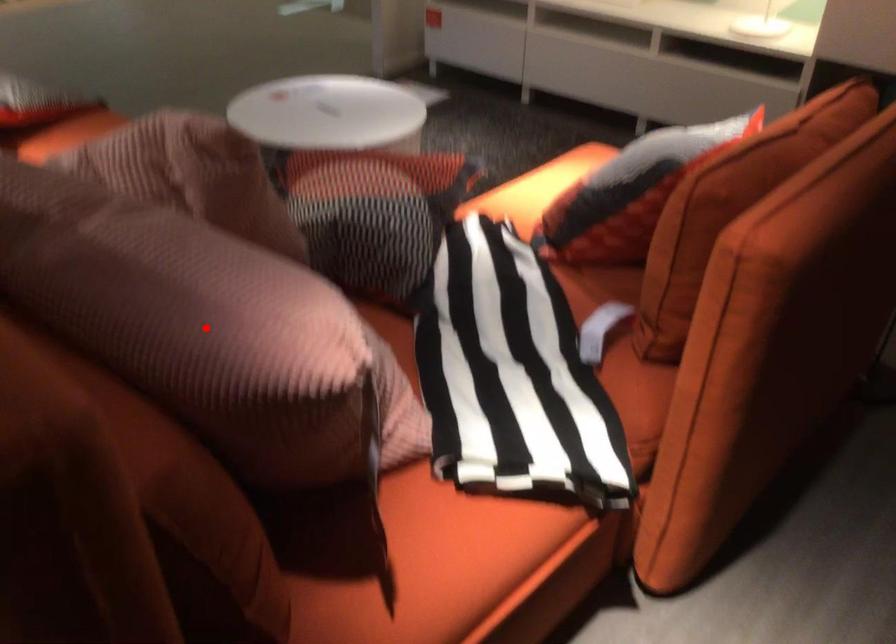
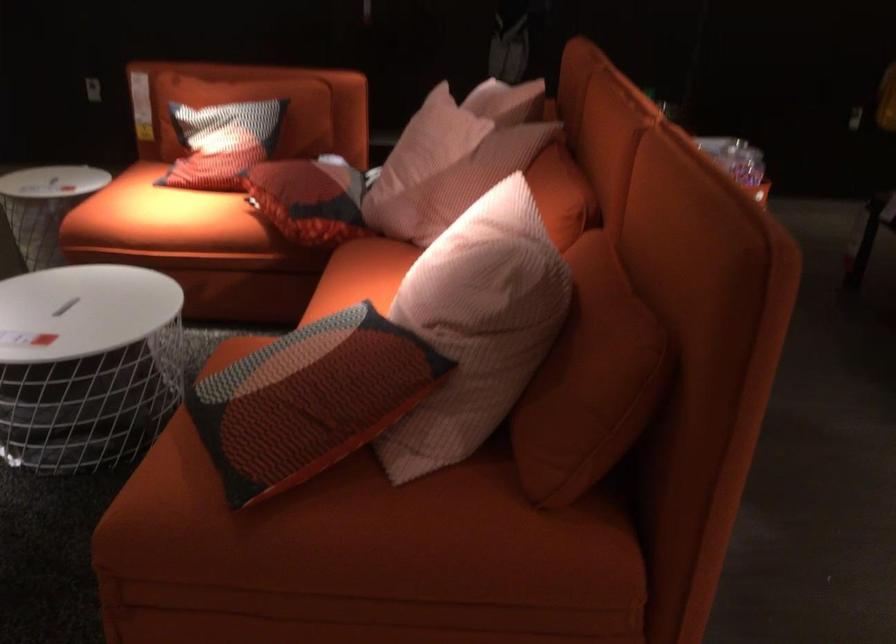
Question: I am providing you with two images of the same scene from different viewpoints. A red point is marked on the first image. At the location where the point appears in image 1, is it still visible in image 2?

Choices:
 (A) Yes
 (B) No

Answer: (B)